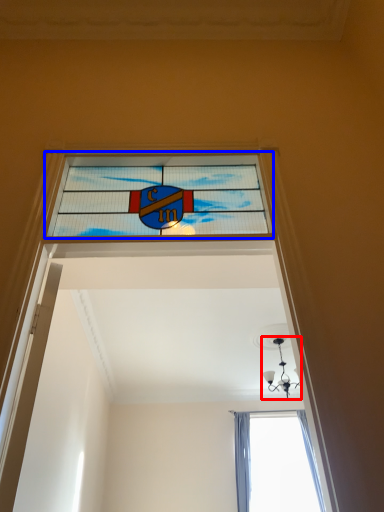
Question: Among these objects, which one is nearest to the camera, light fixture (highlighted by a red box) or window (highlighted by a blue box)?

Choices:
 (A) light fixture
 (B) window

Answer: (B)